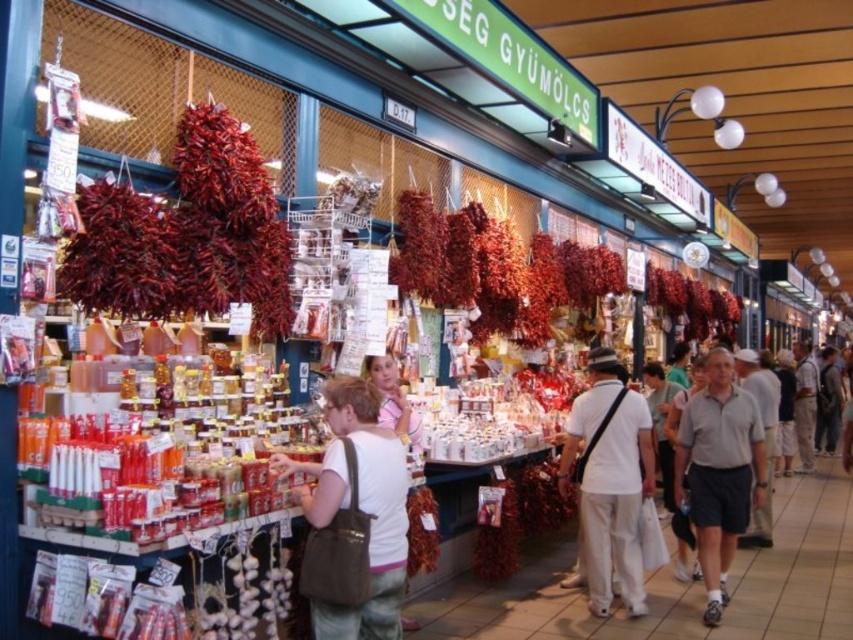
You are a customer at the market stall and want to locate the dried red pepper at left. Based on the stall layout, where should you look relative to the green signage?

The dried red pepper at left is hanging from the ceiling at position coordinates point (187, 234), so you should look above the green signage to find it.

You are a customer at the market and want to pick up both the matte brown bag at center and the white cotton shirt at center. Which one should you reach for first if you want to grab the one on the left?

The matte brown bag at center is to the left of the white cotton shirt at center, so you should reach for the matte brown bag at center first.

You are a customer at the market stall and want to buy some dried red peppers. The peppers are hanging from the ceiling. You are standing at point A, which is at the bottom left corner of the stall. Can you reach the dried red pepper at left located at point B, which is at point (187, 234)?

The dried red pepper at left is located at point (187, 234). Since you are standing at the bottom left corner of the stall, you would need to move towards the right or forward to reach it, but the exact distance isn